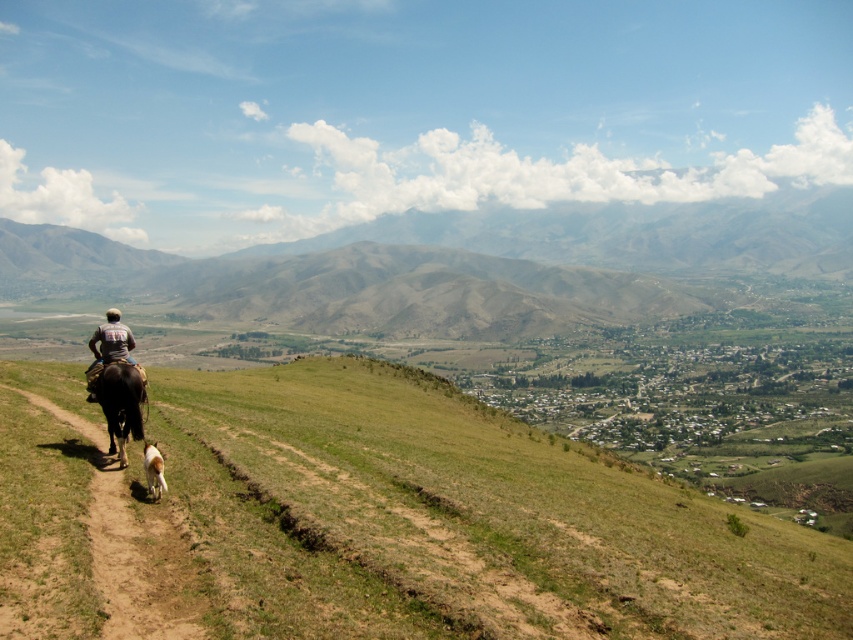
You are standing at the top of the green grassy hill at center and want to walk down to the dirt path. Which direction should you go relative to the green grassy hillside at center?

You should go downward towards the green grassy hillside at center because the green grassy hillside at center is below the green grassy hill at center, meaning the hillside is lower in elevation.

You are planning to walk your white fur dog at lower left along the brown dirt path at lower left. Since the path is narrow, will the dog have enough space to walk comfortably without stepping off the path?

The brown dirt path at lower left is wider than the white fur dog at lower left, so there should be enough space for the dog to walk comfortably without stepping off the path.

You are a photographer planning to take a picture of the green grassy hill at center and the white fur dog at lower left. Based on their sizes, which object should you focus on first to ensure both are in the frame?

The green grassy hill at center is larger in size than the white fur dog at lower left, so you should focus on the green grassy hill at center first to ensure both are in the frame.